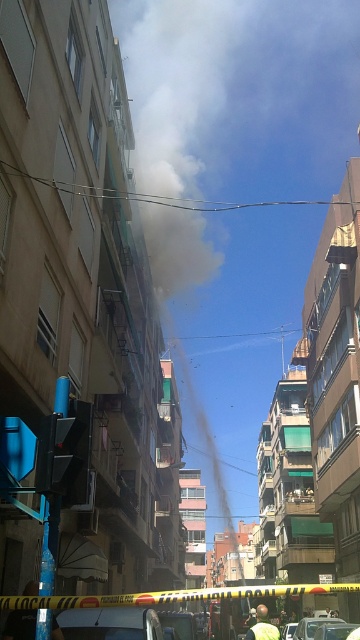
Question: Is white smoke at center above yellow fabric shirt at center?

Choices:
 (A) no
 (B) yes

Answer: (B)

Question: Which point is closer to the camera?

Choices:
 (A) white smoke at center
 (B) yellow fabric shirt at center

Answer: (B)

Question: Which point is closer to the camera taking this photo?

Choices:
 (A) (167, 228)
 (B) (264, 618)

Answer: (B)

Question: Considering the relative positions of white smoke at center and yellow fabric shirt at center in the image provided, where is white smoke at center located with respect to yellow fabric shirt at center?

Choices:
 (A) above
 (B) below

Answer: (A)

Question: Among these objects, which one is farthest from the camera?

Choices:
 (A) yellow fabric shirt at center
 (B) white smoke at center

Answer: (B)

Question: Is white smoke at center wider than yellow fabric shirt at center?

Choices:
 (A) no
 (B) yes

Answer: (B)